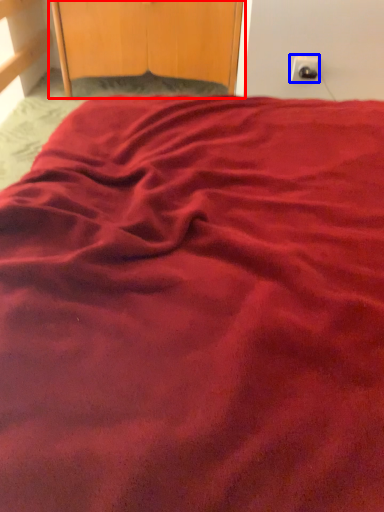
Question: Which point is closer to the camera, dresser (highlighted by a red box) or electric outlet (highlighted by a blue box)?

Choices:
 (A) dresser
 (B) electric outlet

Answer: (B)